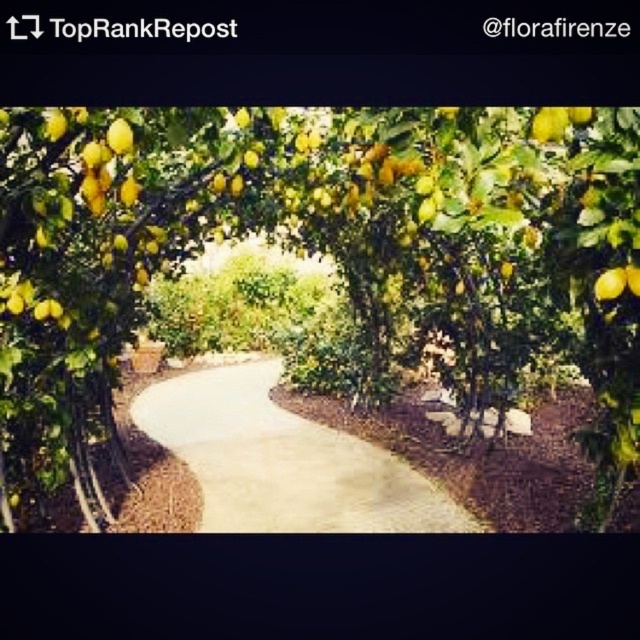
Is point (17, 195) more distant than point (620, 280)?

Yes, point (17, 195) is behind point (620, 280).

Does yellow matte lemon tree at center have a smaller size compared to yellow matte lemon at upper right?

No.

Who is more forward, (632, 298) or (600, 298)?

Point (600, 298) is more forward.

Where is `yellow matte lemon tree at center`? yellow matte lemon tree at center is located at coordinates (323, 252).

Is smooth concrete path at center to the right of yellow matte lemon at upper right from the viewer's perspective?

Incorrect, smooth concrete path at center is not on the right side of yellow matte lemon at upper right.

Is smooth concrete path at center thinner than yellow matte lemon at upper right?

Incorrect, smooth concrete path at center's width is not less than yellow matte lemon at upper right's.

Which is in front, point (388, 516) or point (604, 300)?

Point (604, 300) is more forward.

I want to click on smooth concrete path at center, so click(284, 461).

Between point (396, 328) and point (410, 524), which one is positioned behind?

The point (396, 328) is more distant.

Does point (612, 195) come behind point (260, 428)?

No.

Measure the distance between point (451, 131) and camera.

A distance of 2.59 meters exists between point (451, 131) and camera.

Find the location of a particular element. The image size is (640, 640). yellow matte lemon tree at center is located at coordinates (323, 252).